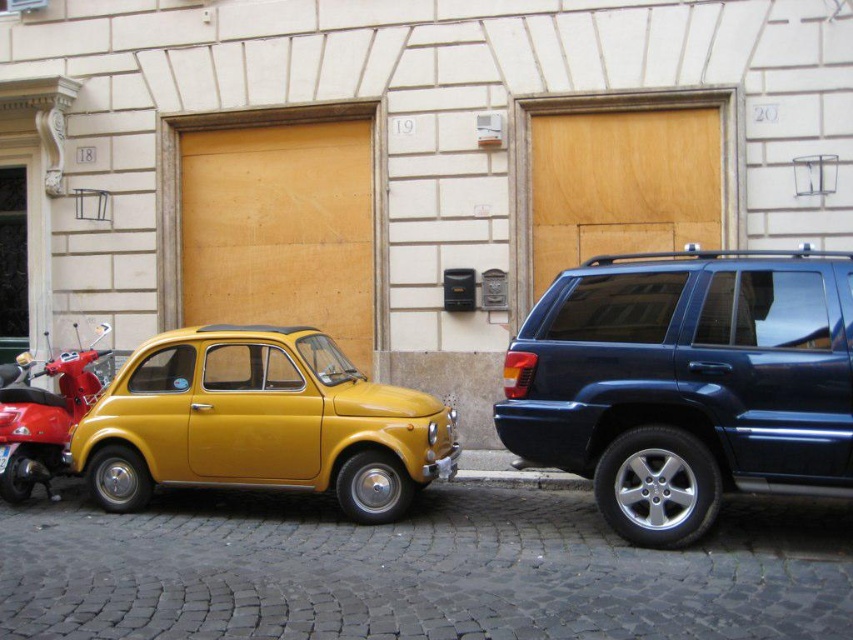
Between yellow matte car at center and shiny red scooter at left, which one has more height?

yellow matte car at center

Who is more distant from viewer, (230, 420) or (44, 403)?

Point (44, 403)

Which is in front, point (231, 387) or point (25, 460)?

Point (231, 387) is in front.

Locate an element on the screen. yellow matte car at center is located at coordinates tap(260, 422).

Who is shorter, shiny dark blue minivan at right or shiny red scooter at left?

shiny red scooter at left is shorter.

Which is behind, point (635, 449) or point (54, 445)?

The point (54, 445) is behind.

Between point (766, 310) and point (3, 422), which one is positioned behind?

Positioned behind is point (3, 422).

Where is `shiny dark blue minivan at right`? This screenshot has width=853, height=640. shiny dark blue minivan at right is located at coordinates (686, 381).

Does point (537, 410) come closer to viewer compared to point (120, 376)?

Yes, it is.

Which is in front, point (531, 378) or point (131, 419)?

Positioned in front is point (531, 378).

Does point (834, 330) come behind point (428, 396)?

No, (834, 330) is closer to viewer.

Image resolution: width=853 pixels, height=640 pixels. What are the coordinates of `shiny dark blue minivan at right` in the screenshot? It's located at (686, 381).